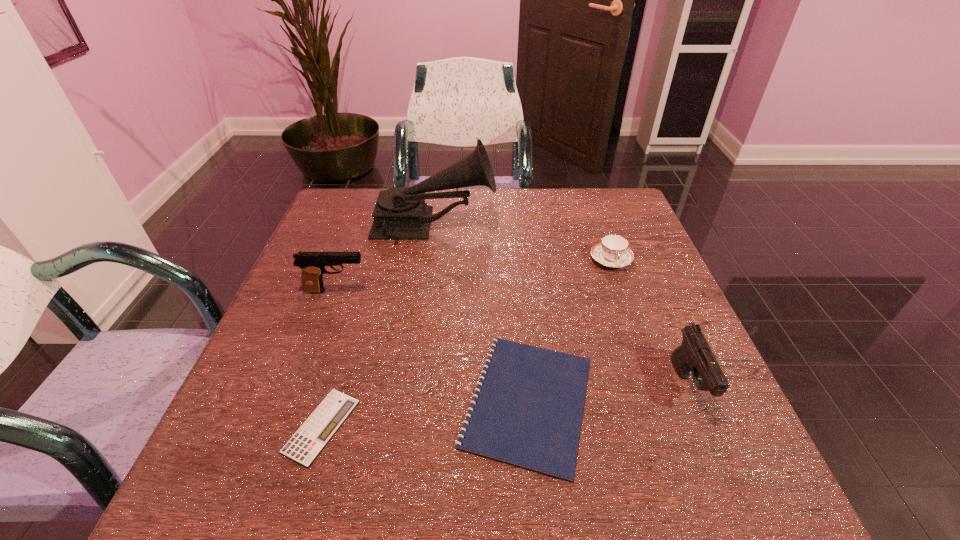
Identify the location of unoccupied position between the fourth nearest object and the third shortest object. (473, 275).

You are a GUI agent. You are given a task and a screenshot of the screen. Output one action in this format:
    pyautogui.click(x=<x>, y=<y>)
    Task: Click on the empty space that is in between the farthest object and the notepad
    Image resolution: width=960 pixels, height=540 pixels.
    Given the screenshot: What is the action you would take?
    tap(481, 314)

Where is `unoccupied position between the nearer pistol and the notepad`? unoccupied position between the nearer pistol and the notepad is located at coordinates (609, 394).

Identify the location of empty space that is in between the right pistol and the teacup. (650, 323).

Where is `vacant area that lies between the fourth tallest object and the tallest object`? vacant area that lies between the fourth tallest object and the tallest object is located at coordinates click(522, 243).

Where is `empty space between the shortest object and the farther pistol`? This screenshot has width=960, height=540. empty space between the shortest object and the farther pistol is located at coordinates (329, 359).

Find the location of a particular element. free space between the nearer pistol and the farther pistol is located at coordinates (513, 339).

Where is `free spot between the left pistol and the calculator`? free spot between the left pistol and the calculator is located at coordinates (329, 359).

You are a GUI agent. You are given a task and a screenshot of the screen. Output one action in this format:
    pyautogui.click(x=<x>, y=<y>)
    Task: Click on the free space that is in between the second shortest object and the farthest object
    
    Given the screenshot: What is the action you would take?
    [x=481, y=314]

At what (x,y) coordinates should I click in order to perform the action: click on object that stands as the fifth closest to the third shortest object. Please return your answer as a coordinate pair (x, y). The width and height of the screenshot is (960, 540). Looking at the image, I should click on (310, 439).